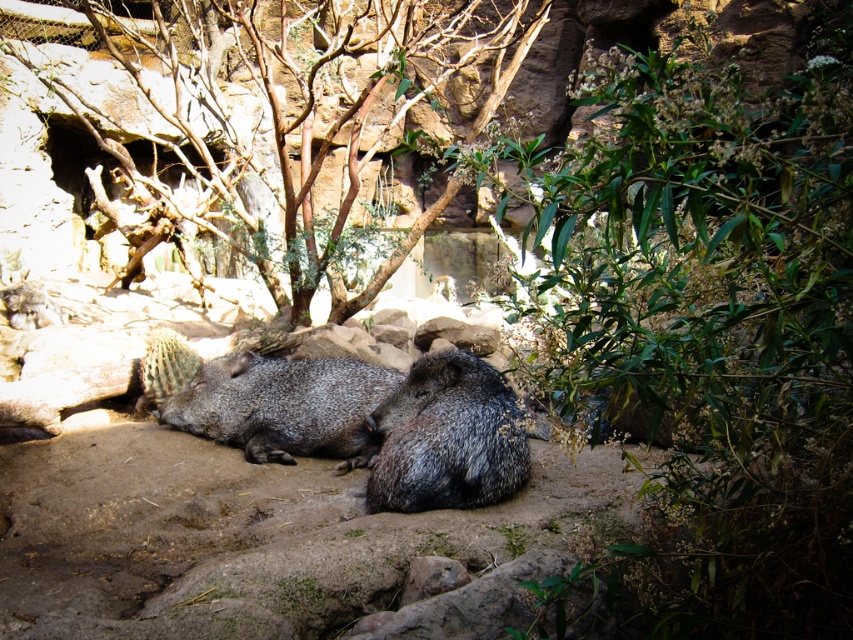
You are a zookeeper planning to place a feeding station between the brown rough bark tree at center and the gray spiny at center. Based on their positions, which tree should the feeding station be closer to?

The feeding station should be placed closer to the gray spiny at center because the brown rough bark tree at center is positioned to the right of the gray spiny at center, meaning the gray spiny is to the left of the brown rough bark tree. Therefore, the midpoint between them would be closer to the gray spiny.

You are a zookeeper who needs to place a feeding station between the brown rough bark tree at center and the gray fuzzy animal at center. The feeding station requires a minimum of 3 meters of space. Is there enough space between them to place the feeding station?

The brown rough bark tree at center is 5.48 meters from the gray fuzzy animal at center. Since the feeding station requires a minimum of 3 meters of space, there is sufficient space between them to place the feeding station.

You are a zookeeper planning to place a new feeding station between the brown rough bark tree at center and the gray spiny at center. Based on their positions, which tree should the feeding station be closer to?

The brown rough bark tree at center is positioned over the gray spiny at center, so the feeding station should be placed closer to the gray spiny at center since it is lower and the feeding station needs to be accessible on the ground level.